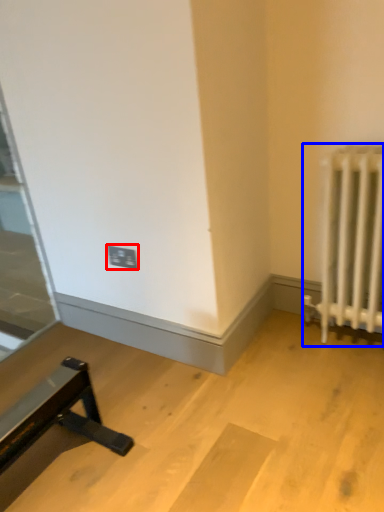
Question: Among these objects, which one is nearest to the camera, electric outlet (highlighted by a red box) or radiator (highlighted by a blue box)?

Choices:
 (A) electric outlet
 (B) radiator

Answer: (B)